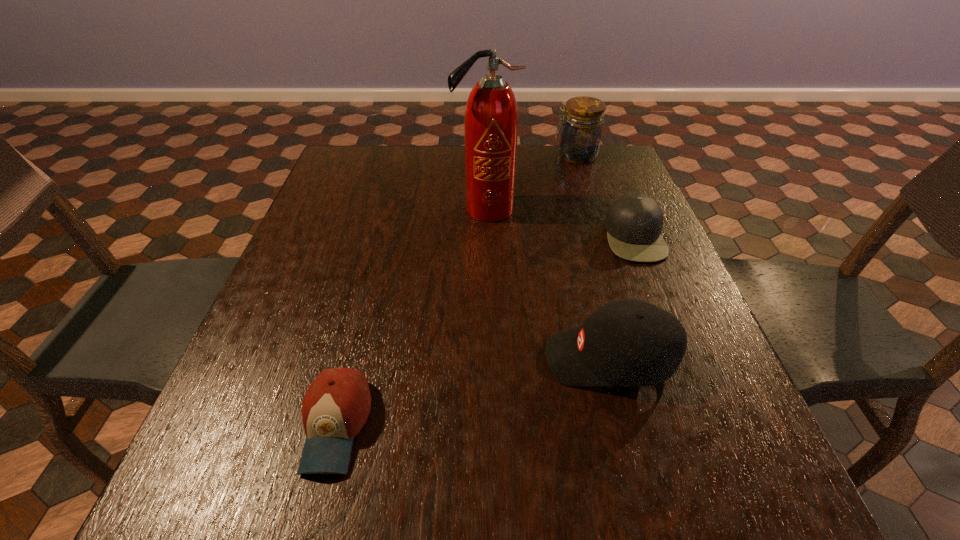
The height and width of the screenshot is (540, 960). I want to click on vacant space that's between the fourth object from right to left and the taller baseball cap, so click(547, 284).

The width and height of the screenshot is (960, 540). I want to click on vacant space that is in between the second object from left to right and the farthest object, so click(x=531, y=183).

At what (x,y) coordinates should I click in order to perform the action: click on vacant space in between the second tallest object and the cap. Please return your answer as a coordinate pair (x, y). This screenshot has height=540, width=960. Looking at the image, I should click on (605, 196).

Find the location of a particular element. free space between the leftmost object and the farthest object is located at coordinates (456, 291).

Identify which object is the closest to the fourth shortest object. Please provide its 2D coordinates. Your answer should be formatted as a tuple, i.e. [(x, y)], where the tuple contains the x and y coordinates of a point satisfying the conditions above.

[(491, 118)]

Find the location of `object that is the second nearest to the fire extinguisher`. object that is the second nearest to the fire extinguisher is located at coordinates (634, 222).

Where is `free spot that satisfies the following two spatial constraints: 1. on the lid of the fourth shortest object; 2. on the front-facing side of the shortest object`? The image size is (960, 540). free spot that satisfies the following two spatial constraints: 1. on the lid of the fourth shortest object; 2. on the front-facing side of the shortest object is located at coordinates (660, 425).

This screenshot has height=540, width=960. In order to click on free space that satisfies the following two spatial constraints: 1. with a logo on the front of the third tallest object; 2. on the front-facing side of the shortest object in this screenshot , I will do `click(626, 425)`.

Identify the location of vacant space that satisfies the following two spatial constraints: 1. on the brim of the cap; 2. on the front-facing side of the shorter baseball cap. point(709,425).

This screenshot has width=960, height=540. I want to click on free region that satisfies the following two spatial constraints: 1. on the lid of the jar; 2. on the front-facing side of the leftmost object, so click(x=660, y=425).